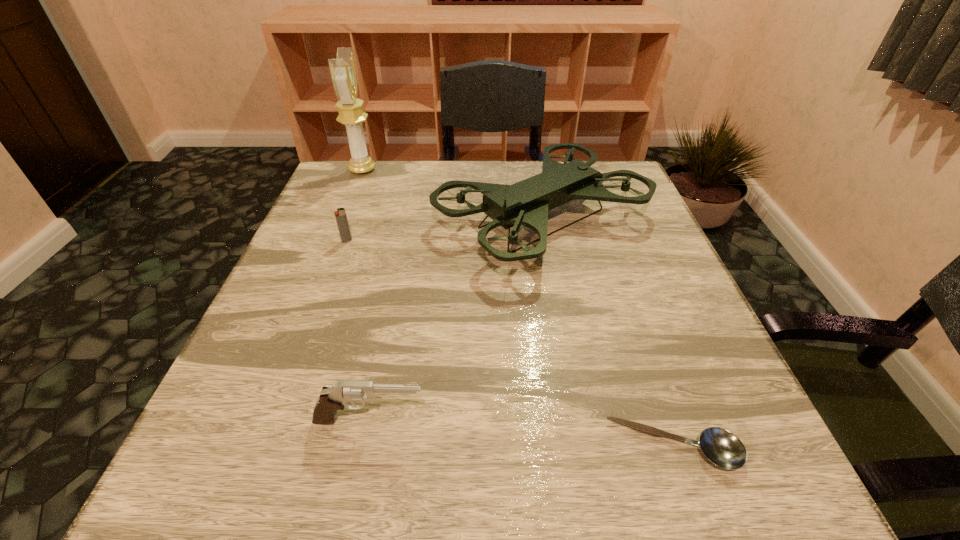
Identify the location of object at the near right corner. This screenshot has height=540, width=960. (724, 449).

In order to click on free spot at the far edge of the desktop in this screenshot , I will do `click(447, 195)`.

Find the location of `vacant space at the left edge`. vacant space at the left edge is located at coordinates (336, 249).

This screenshot has height=540, width=960. I want to click on free space at the right edge of the desktop, so click(x=690, y=319).

At what (x,y) coordinates should I click in order to perform the action: click on vacant space at the far left corner of the desktop. Please return your answer as a coordinate pair (x, y). Looking at the image, I should click on (362, 185).

Find the location of a particular element. The height and width of the screenshot is (540, 960). vacant space at the near left corner is located at coordinates 301,482.

In the image, there is a desktop. Identify the location of vacant space at the far right corner. (612, 168).

Where is `free space at the near right corner of the desktop`? free space at the near right corner of the desktop is located at coordinates (709, 465).

Locate an element on the screen. free space between the third tallest object and the shortest object is located at coordinates (522, 434).

Locate an element on the screen. vacant space in between the tallest object and the ladle is located at coordinates (518, 308).